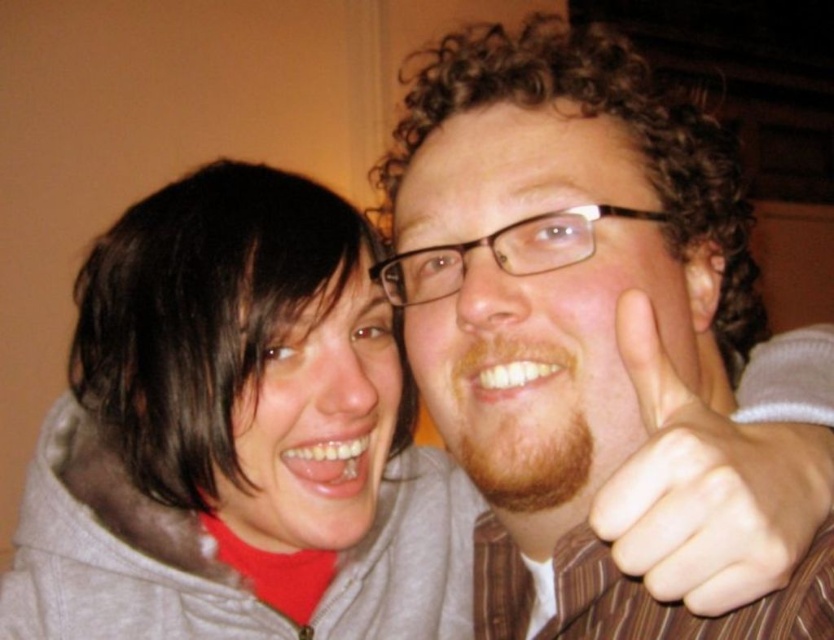
Question: Is the position of matte gray hoodie at center less distant than that of skinny white hand at right?

Choices:
 (A) no
 (B) yes

Answer: (A)

Question: Does matte gray hoodie at center have a larger size compared to skinny white hand at right?

Choices:
 (A) yes
 (B) no

Answer: (A)

Question: Is matte gray hoodie at center thinner than skinny white hand at right?

Choices:
 (A) no
 (B) yes

Answer: (A)